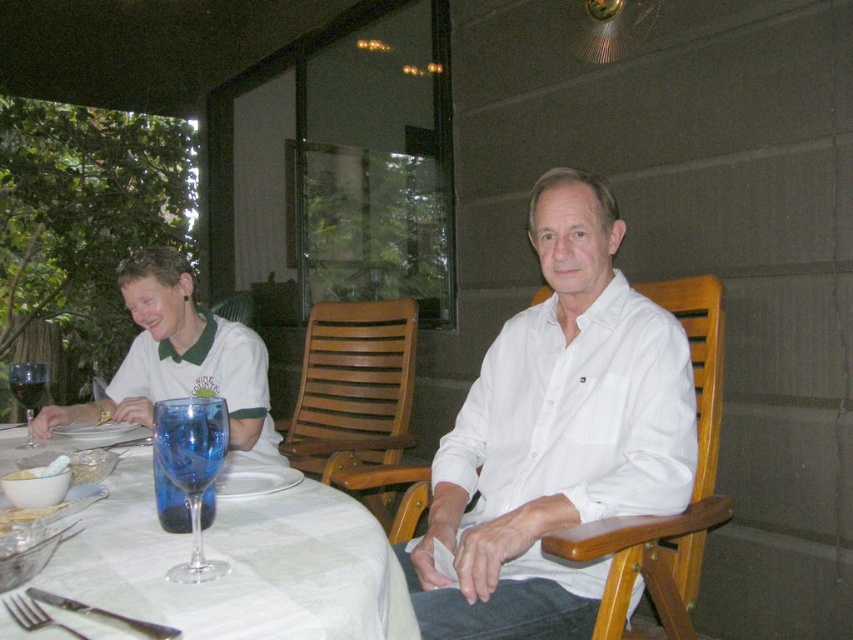
Question: Does light brown wooden chair at center have a larger size compared to white cotton shirt at upper left?

Choices:
 (A) yes
 (B) no

Answer: (A)

Question: Does white cotton shirt at upper left come behind transparent glass wine glass at left?

Choices:
 (A) yes
 (B) no

Answer: (A)

Question: Which of the following is the closest to the observer?

Choices:
 (A) blue glass at table left
 (B) transparent glass wine glass at left
 (C) white cloth table at lower left

Answer: (C)

Question: Which object appears farthest from the camera in this image?

Choices:
 (A) white cotton shirt at upper center
 (B) transparent glass wine glass at left

Answer: (B)

Question: Which point is closer to the camera?

Choices:
 (A) transparent glass wine glass at left
 (B) white cotton shirt at center
 (C) white cloth table at lower left

Answer: (C)

Question: Is the position of white cloth table at lower left more distant than that of white cotton shirt at upper left?

Choices:
 (A) no
 (B) yes

Answer: (A)